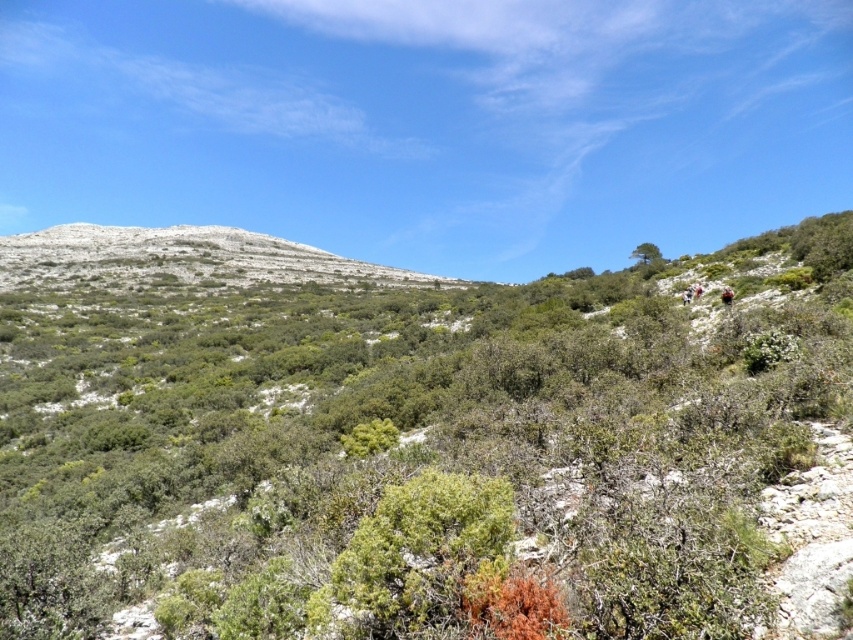
Question: Is green shrubs at center smaller than white rocky mountain at upper left?

Choices:
 (A) no
 (B) yes

Answer: (B)

Question: Can you confirm if green shrubs at center is smaller than white rocky mountain at upper left?

Choices:
 (A) yes
 (B) no

Answer: (A)

Question: Which of the following is the closest to the observer?

Choices:
 (A) (212, 232)
 (B) (671, 397)

Answer: (B)

Question: Does green shrubs at center lie in front of white rocky mountain at upper left?

Choices:
 (A) yes
 (B) no

Answer: (A)

Question: Which object appears farthest from the camera in this image?

Choices:
 (A) white rocky mountain at upper left
 (B) green shrubs at center

Answer: (A)